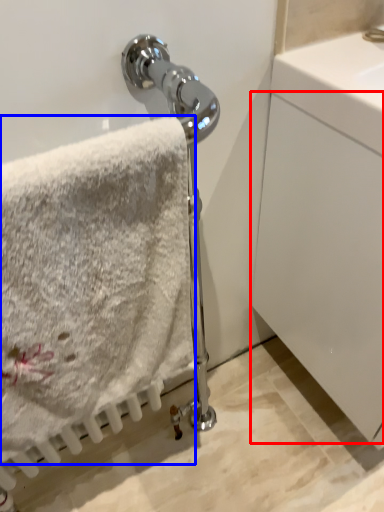
Question: Which of the following is the closest to the observer, glass door (highlighted by a red box) or towel (highlighted by a blue box)?

Choices:
 (A) glass door
 (B) towel

Answer: (B)